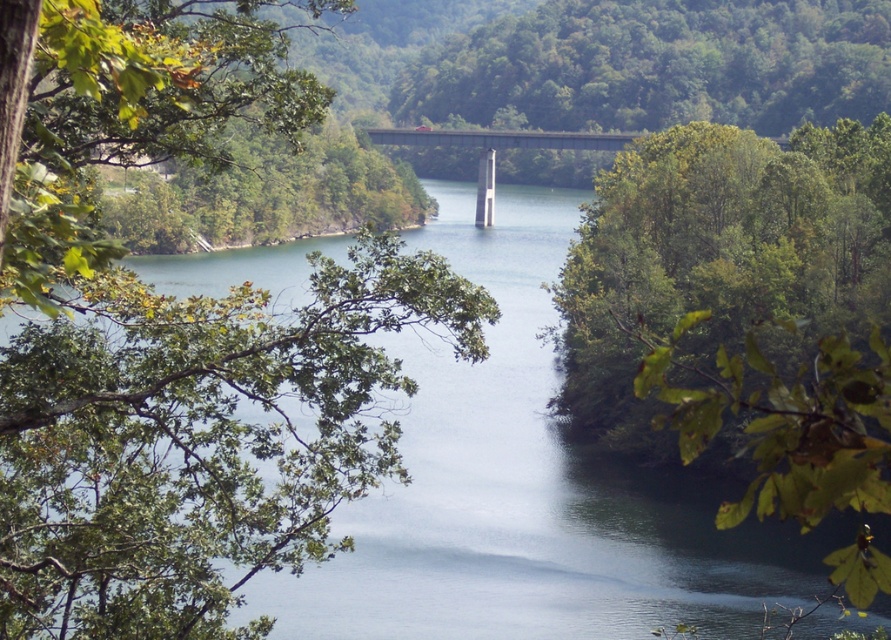
Question: Is green leafy tree at left behind green leafy tree at center?

Choices:
 (A) yes
 (B) no

Answer: (B)

Question: Based on their relative distances, which object is nearer to the concrete bridge at center?

Choices:
 (A) green smooth water at center
 (B) green leafy tree at left
 (C) green leafy tree at center

Answer: (A)

Question: Among these objects, which one is farthest from the camera?

Choices:
 (A) green leafy tree at left
 (B) green leafy trees at center
 (C) green smooth water at center

Answer: (B)

Question: Is green leafy tree at left bigger than green leafy trees at center?

Choices:
 (A) yes
 (B) no

Answer: (B)

Question: Does green leafy trees at center come behind concrete bridge at center?

Choices:
 (A) no
 (B) yes

Answer: (B)

Question: Which of the following is the farthest from the observer?

Choices:
 (A) concrete bridge at center
 (B) green leafy tree at center
 (C) green smooth water at center

Answer: (A)